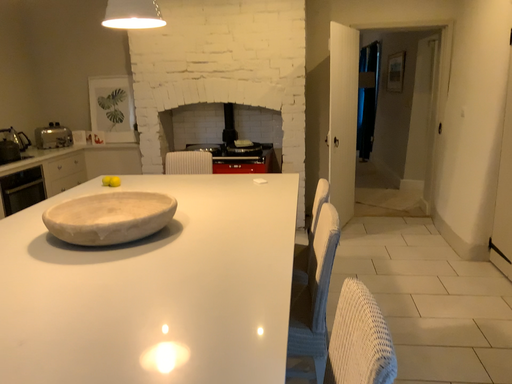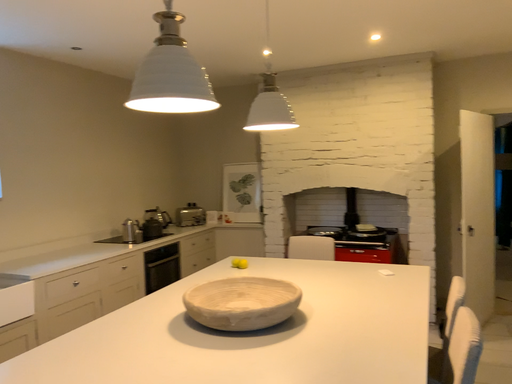
Question: Which way did the camera rotate in the video?

Choices:
 (A) rotated downward
 (B) rotated upward

Answer: (B)